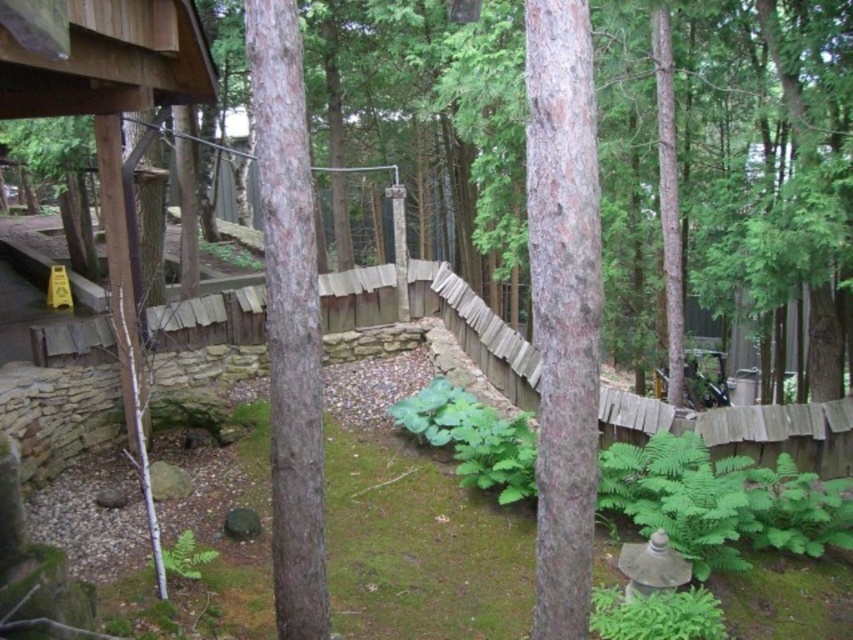
Question: Does smooth brown tree trunk at center have a larger size compared to brown rough bark tree at center?

Choices:
 (A) no
 (B) yes

Answer: (A)

Question: Which object appears farthest from the camera in this image?

Choices:
 (A) smooth brown tree trunk at center
 (B) brown rough bark tree at center

Answer: (B)

Question: Which point is closer to the camera?

Choices:
 (A) smooth brown tree trunk at center
 (B) brown rough bark tree at center

Answer: (A)

Question: Does smooth brown tree trunk at center appear over brown rough bark tree at center?

Choices:
 (A) no
 (B) yes

Answer: (A)

Question: Does smooth brown tree trunk at center appear under brown rough bark tree at center?

Choices:
 (A) yes
 (B) no

Answer: (A)

Question: Which object is farther from the camera taking this photo?

Choices:
 (A) brown rough bark tree at center
 (B) smooth brown tree trunk at center

Answer: (A)